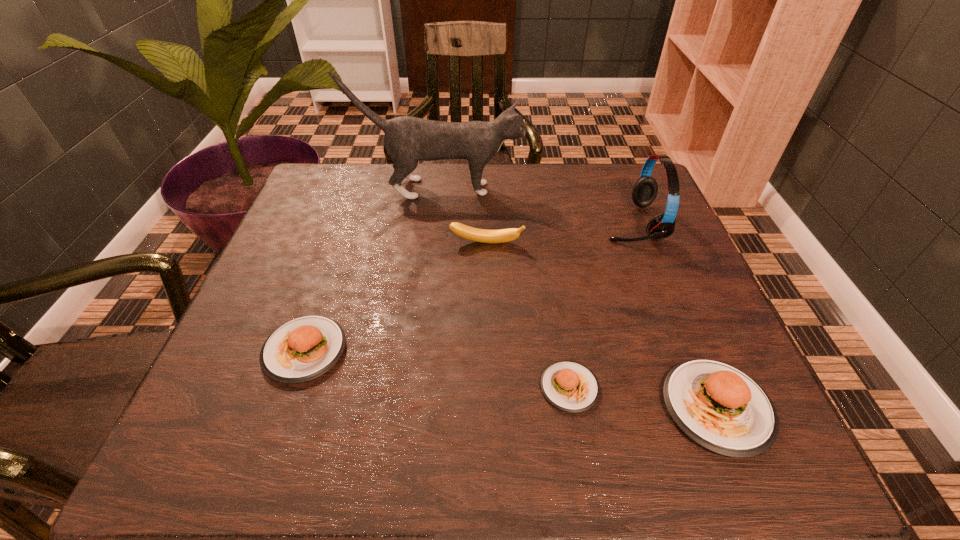
The height and width of the screenshot is (540, 960). In order to click on vacant space at the far left corner of the desktop in this screenshot , I will do [x=324, y=185].

Locate an element on the screen. free space at the near left corner is located at coordinates (290, 388).

Find the location of `free space between the fifth shortest object and the fifth tallest object`. free space between the fifth shortest object and the fifth tallest object is located at coordinates (468, 286).

At what (x,y) coordinates should I click in order to perform the action: click on vacant space that's between the rightmost food and the tallest object. Please return your answer as a coordinate pair (x, y). Looking at the image, I should click on (578, 298).

Where is `free space between the fifth shortest object and the shortest object`? free space between the fifth shortest object and the shortest object is located at coordinates (601, 305).

At what (x,y) coordinates should I click in order to perform the action: click on free space between the shortest object and the second tallest food. Please return your answer as a coordinate pair (x, y). Looking at the image, I should click on (437, 369).

Locate an element on the screen. free space that is in between the rightmost food and the banana is located at coordinates (602, 326).

The image size is (960, 540). I want to click on free area in between the rightmost food and the banana, so click(602, 326).

Locate an element on the screen. vacant space that's between the second tallest object and the second shortest food is located at coordinates (468, 286).

You are a GUI agent. You are given a task and a screenshot of the screen. Output one action in this format:
    pyautogui.click(x=<x>, y=<y>)
    Task: Click on the free area in between the shortest object and the rightmost food
    
    Given the screenshot: What is the action you would take?
    pyautogui.click(x=643, y=397)